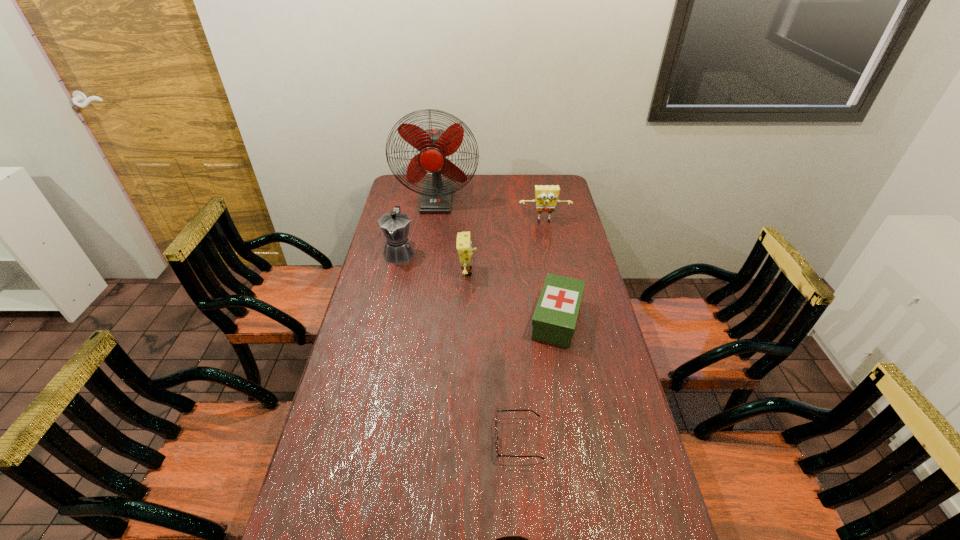
Locate an element on the screen. free space between the left sponge and the second farthest object is located at coordinates (506, 247).

Locate an element on the screen. free spot between the nearer sponge and the farthest object is located at coordinates (452, 236).

Identify the location of vacant area that lies between the sixth farthest object and the nearer sponge. The height and width of the screenshot is (540, 960). (492, 355).

Identify the location of empty space between the sixth shortest object and the second nearest object. The image size is (960, 540). (459, 346).

The height and width of the screenshot is (540, 960). Find the location of `blank region between the farther sponge and the shortest object`. blank region between the farther sponge and the shortest object is located at coordinates (532, 330).

This screenshot has height=540, width=960. What are the coordinates of `object that can be found as the third closest to the camcorder` in the screenshot? It's located at (465, 251).

The width and height of the screenshot is (960, 540). Identify the location of the fourth closest object to the right sponge. (395, 225).

Locate an element on the screen. free space that satisfies the following two spatial constraints: 1. on the front-facing side of the first-aid kit; 2. on the right side of the farthest object is located at coordinates (420, 319).

At what (x,y) coordinates should I click in order to perform the action: click on free space that satisfies the following two spatial constraints: 1. on the face of the first-aid kit; 2. on the left side of the left sponge. Please return your answer as a coordinate pair (x, y). Looking at the image, I should click on (466, 319).

Locate an element on the screen. The height and width of the screenshot is (540, 960). free space that satisfies the following two spatial constraints: 1. on the front side of the first-aid kit; 2. on the lenses of the sixth farthest object is located at coordinates (579, 439).